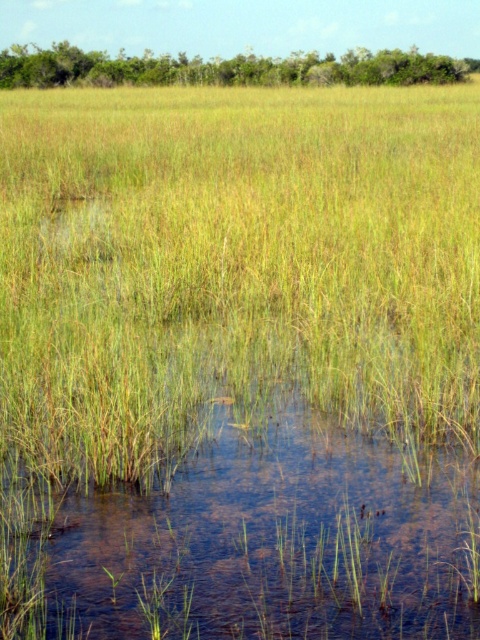
Question: Does clear water at center appear on the right side of green grass at upper center?

Choices:
 (A) no
 (B) yes

Answer: (B)

Question: Which object appears farthest from the camera in this image?

Choices:
 (A) clear water at center
 (B) green grass at upper center

Answer: (B)

Question: From the image, what is the correct spatial relationship of clear water at center in relation to green grass at upper center?

Choices:
 (A) above
 (B) below

Answer: (B)

Question: Which of the following is the farthest from the observer?

Choices:
 (A) (103, 67)
 (B) (336, 618)

Answer: (A)

Question: Considering the relative positions of clear water at center and green grass at upper center in the image provided, where is clear water at center located with respect to green grass at upper center?

Choices:
 (A) below
 (B) above

Answer: (A)